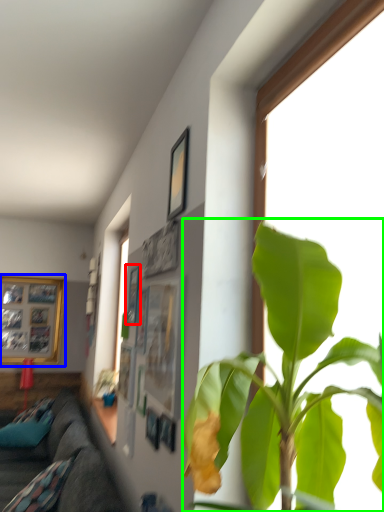
Question: Which object is positioned closest to picture frame (highlighted by a red box)? Select from picture frame (highlighted by a blue box) and houseplant (highlighted by a green box).

Choices:
 (A) picture frame
 (B) houseplant

Answer: (B)